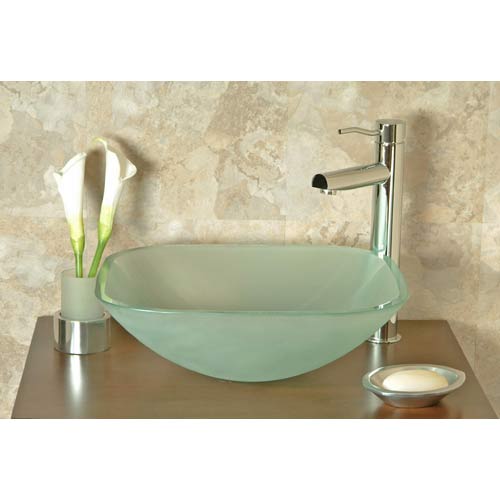
The image size is (500, 500). Find the location of `counter`. counter is located at coordinates (311, 401).